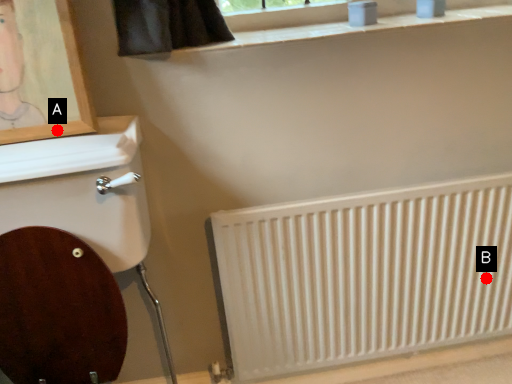
Question: Two points are circled on the image, labeled by A and B beside each circle. Which point is farther from the camera taking this photo?

Choices:
 (A) A is further
 (B) B is further

Answer: (B)